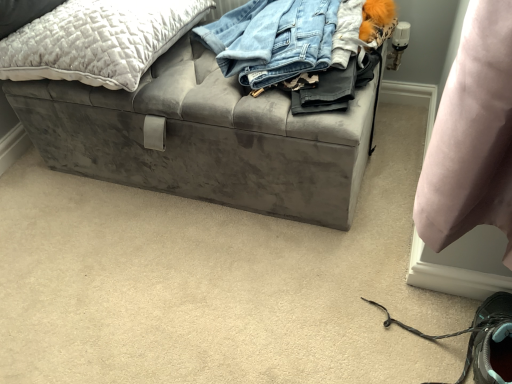
Question: Can you see gray suede shoe at lower right touching quilted gray pillow at upper left?

Choices:
 (A) yes
 (B) no

Answer: (B)

Question: Can you confirm if gray suede shoe at lower right is smaller than quilted gray pillow at upper left?

Choices:
 (A) yes
 (B) no

Answer: (A)

Question: From a real-world perspective, is gray suede shoe at lower right physically below quilted gray pillow at upper left?

Choices:
 (A) no
 (B) yes

Answer: (B)

Question: Is gray suede shoe at lower right positioned far away from quilted gray pillow at upper left?

Choices:
 (A) yes
 (B) no

Answer: (B)

Question: Does gray suede shoe at lower right have a lesser height compared to quilted gray pillow at upper left?

Choices:
 (A) yes
 (B) no

Answer: (B)

Question: Is quilted gray pillow at upper left completely or partially inside gray suede shoe at lower right?

Choices:
 (A) yes
 (B) no

Answer: (B)

Question: Does gray suede shoe at lower right have a larger size compared to velvet gray storage bench at center?

Choices:
 (A) yes
 (B) no

Answer: (B)

Question: Can you confirm if gray suede shoe at lower right is taller than velvet gray storage bench at center?

Choices:
 (A) yes
 (B) no

Answer: (B)

Question: Is velvet gray storage bench at center inside gray suede shoe at lower right?

Choices:
 (A) no
 (B) yes

Answer: (A)

Question: Is gray suede shoe at lower right closer to camera compared to velvet gray storage bench at center?

Choices:
 (A) no
 (B) yes

Answer: (B)

Question: Is gray suede shoe at lower right aimed at velvet gray storage bench at center?

Choices:
 (A) no
 (B) yes

Answer: (A)

Question: Does gray suede shoe at lower right appear on the left side of velvet gray storage bench at center?

Choices:
 (A) no
 (B) yes

Answer: (A)

Question: Is quilted gray pillow at upper left surrounding gray suede shoe at lower right?

Choices:
 (A) no
 (B) yes

Answer: (A)